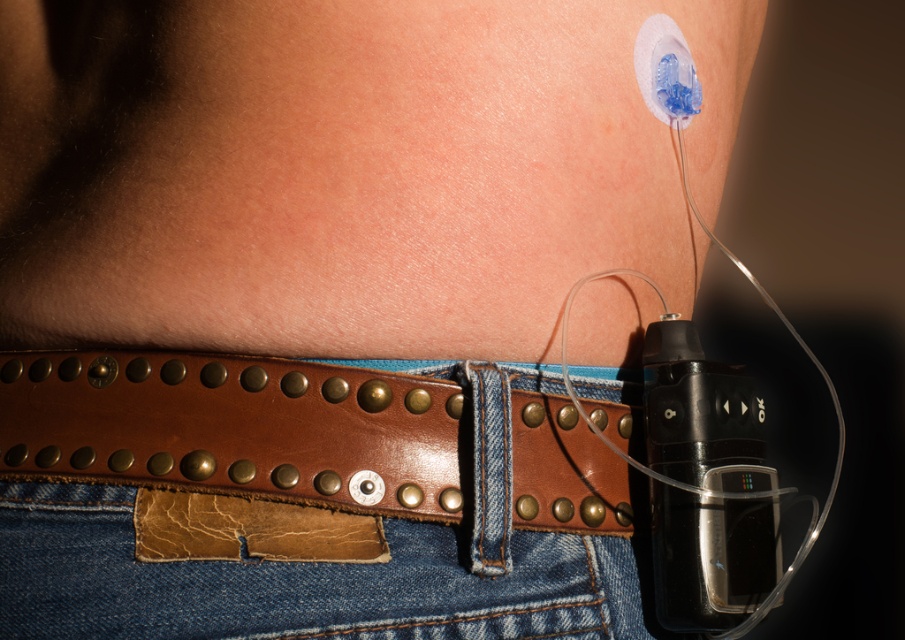
You are a healthcare professional assessing the placement of a medical device on a patient. The device is attached to the skin near the waistline. Given that the point at coordinates point [150,413] is 55.23 centimeters away from you, can you determine if the device is positioned within the safe range for proper monitoring?

The point at coordinates point [150,413] is 55.23 centimeters away from the viewer. Since the safe range for proper monitoring requires the device to be within 60 centimeters, the device is positioned within the safe range.